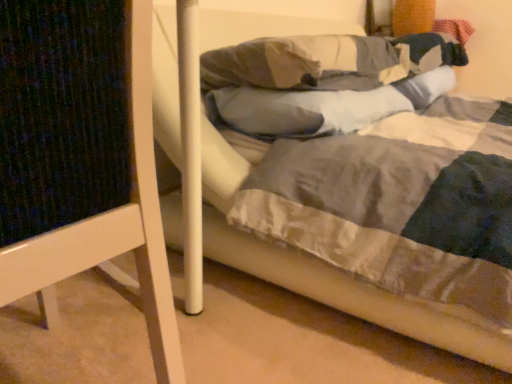
Question: Relative to white soft pillow at center, the 1th pillow viewed from the top, is gray soft pillow at center, which is the 1th pillow from bottom to top, in front or behind?

Choices:
 (A) front
 (B) behind

Answer: (B)

Question: Which is correct: gray soft pillow at center, which is the 1th pillow from bottom to top, is inside white soft pillow at center, arranged as the 2th pillow when ordered from the bottom, or outside of it?

Choices:
 (A) outside
 (B) inside

Answer: (A)

Question: Based on their relative distances, which object is farther from the gray soft pillow at center, which is the 1th pillow from bottom to top?

Choices:
 (A) white wood bed frame at left
 (B) white soft pillow at center, arranged as the 2th pillow when ordered from the bottom

Answer: (A)

Question: Estimate the real-world distances between objects in this image. Which object is farther from the white soft pillow at center, the 1th pillow viewed from the top?

Choices:
 (A) gray soft pillow at center, which is the 1th pillow from bottom to top
 (B) white wood bed frame at left

Answer: (B)